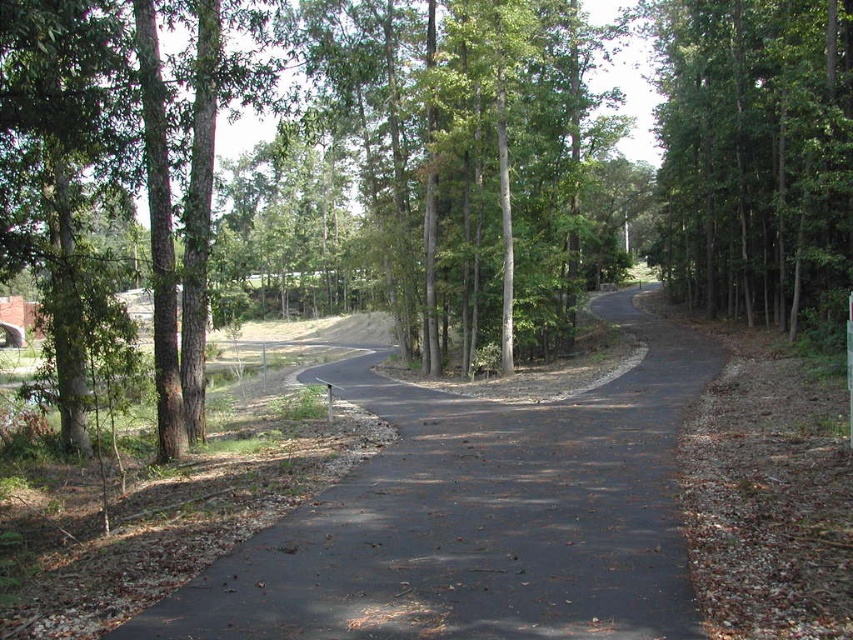
You are standing at the starting point of your hike and see the black asphalt road at center. If you follow the road straight ahead, will it eventually curve to the right or continue straight?

The black asphalt road at center curves gently to the right, so following it straight ahead will lead you along its gentle rightward curve.

You are a hiker walking along the black asphalt road at center and want to reach the green leafy tree at right. Which direction should you walk to get closer to the tree?

The black asphalt road at center is smaller than the green leafy tree at right, so you should walk forward along the black asphalt road at center towards the direction it curves to the right to approach the green leafy tree at right.

You are standing at the start of the black asphalt road at center. Your friend is waiting for you at a point 6 meters ahead along the path. Can you reach your friend before they move further away?

The black asphalt road at center is 5.40 meters away from viewer, so you can reach your friend before they move further away since the distance is within the 6 meters mentioned.